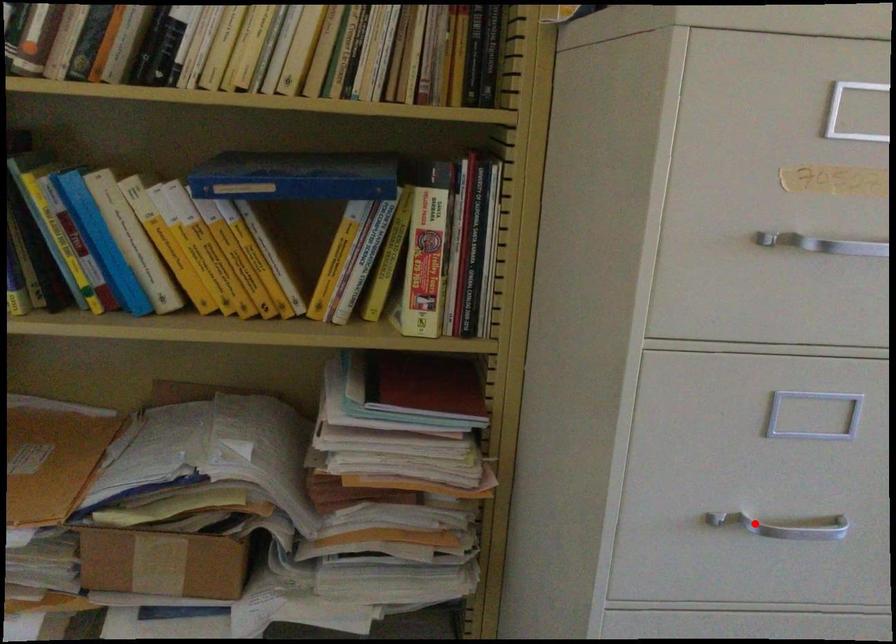
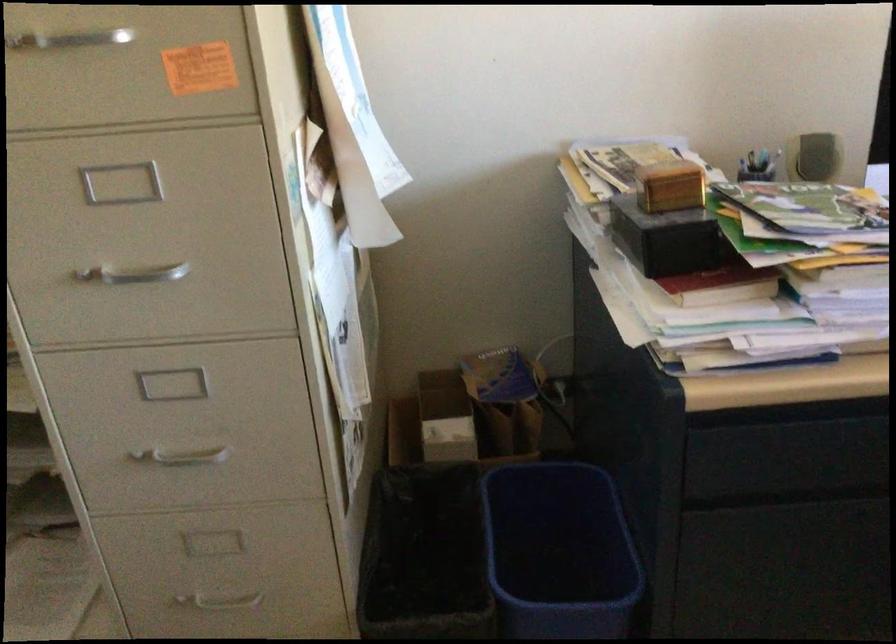
Find the pixel in the second image that matches the highlighted location in the first image.

(134, 274)